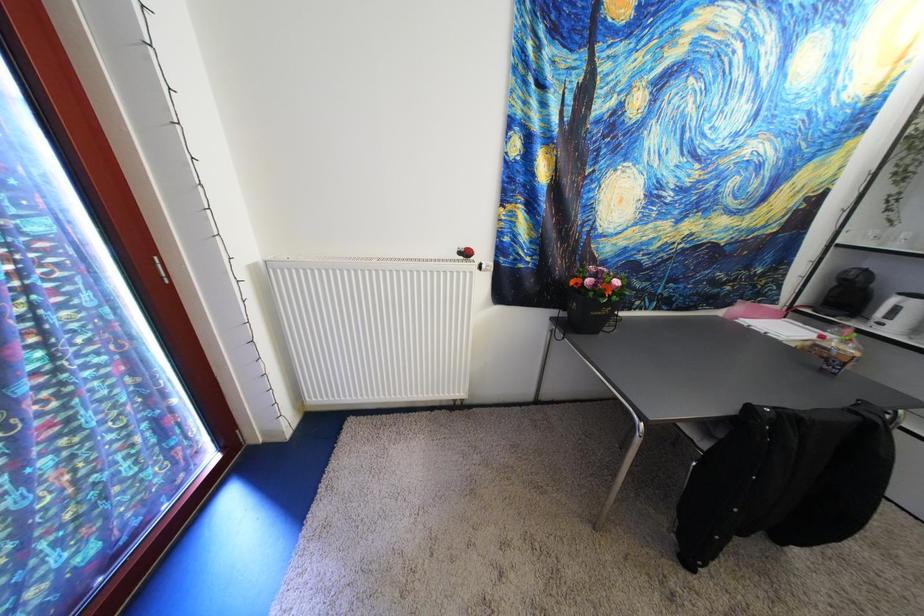
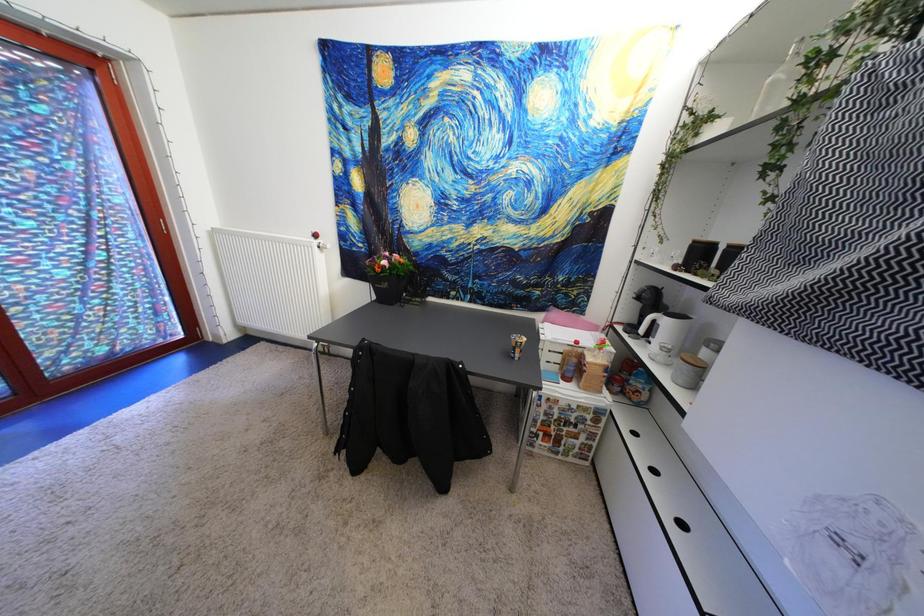
Question: In a continuous first-person perspective shot, in which direction is the camera moving?

Choices:
 (A) Left
 (B) Right
 (C) Forward
 (D) Backward

Answer: (B)